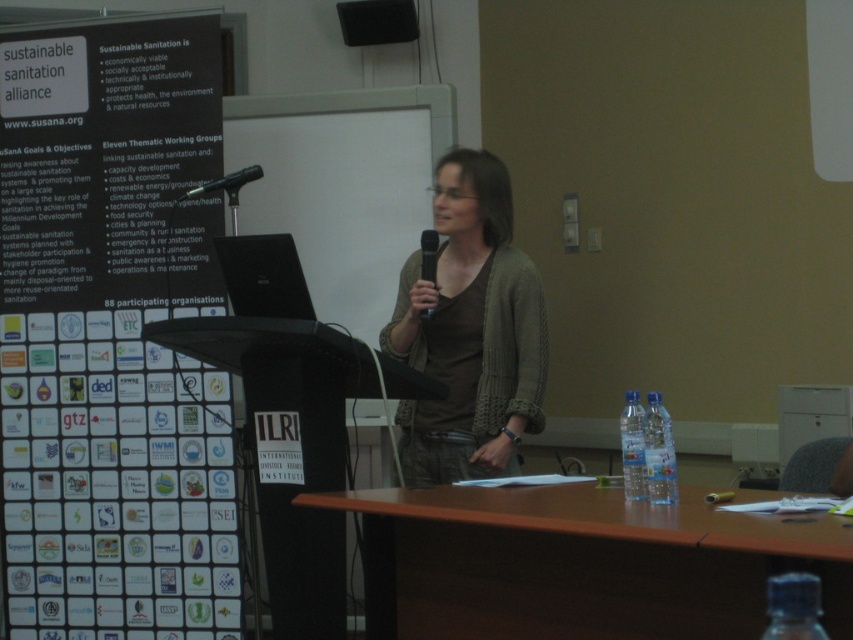
You are organizing a conference and need to choose a water bottle for the speaker. The transparent plastic bottle at lower right and the clear plastic bottle at right are available. Which bottle is shorter and thus easier to handle during the presentation?

The transparent plastic bottle at lower right is not as tall as the clear plastic bottle at right, so the transparent plastic bottle at lower right is shorter and easier to handle during the presentation.

You are organizing a conference and need to place a laptop on the brown wooden table at center. The laptop requires a power outlet that is 2 meters away. Is the outlet within reach if the table is 1.5 meters long?

The brown wooden table at center is located at point [579,564]. However, the distance from the table to the power outlet is not provided in the scene description. Therefore, it is impossible to determine if the outlet is within reach based on the given information.

You are an attendee at the presentation and need to place your clear plastic bottle at table right onto the brown wooden table at center. Is the bottle already on the table?

The brown wooden table at center is below clear plastic bottle at table right, so the bottle is already placed on the table.